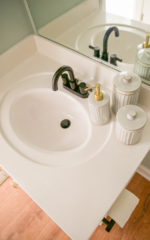
What are the coordinates of `front edge of vanity` in the screenshot? It's located at (36, 205).